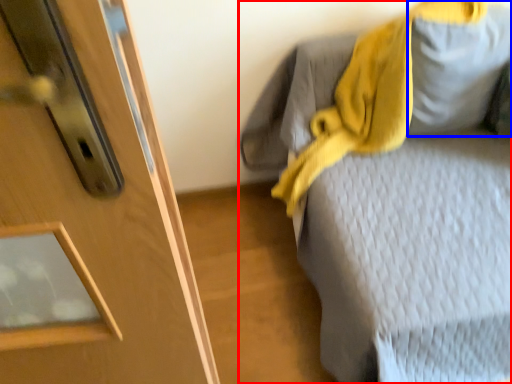
Question: Which point is further to the camera, furniture (highlighted by a red box) or gray (highlighted by a blue box)?

Choices:
 (A) furniture
 (B) gray

Answer: (B)